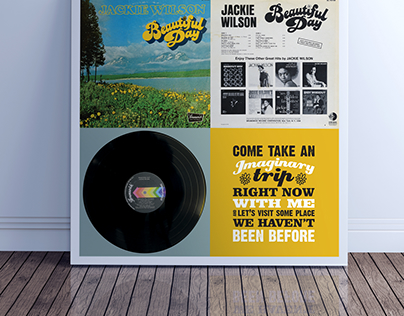
This screenshot has width=404, height=316. What are the coordinates of `poster` in the screenshot? It's located at (210, 124).